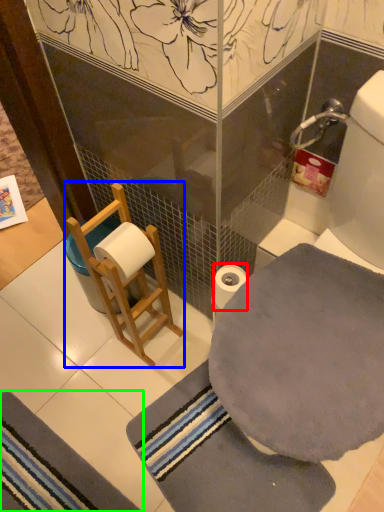
Question: Which object is positioned closest to toilet paper (highlighted by a red box)? Select from armchair (highlighted by a blue box) and bath mat (highlighted by a green box).

Choices:
 (A) armchair
 (B) bath mat

Answer: (A)